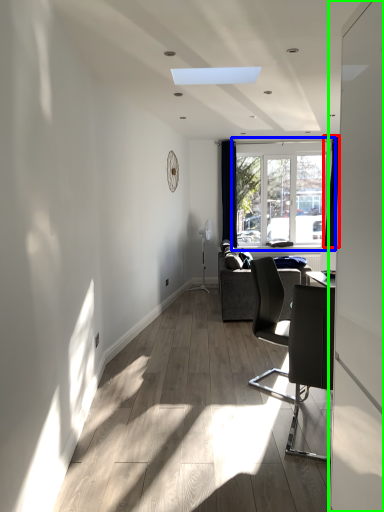
Question: Which object is the farthest from curtain (highlighted by a red box)? Choose among these: window (highlighted by a blue box) or screen door (highlighted by a green box).

Choices:
 (A) window
 (B) screen door

Answer: (B)